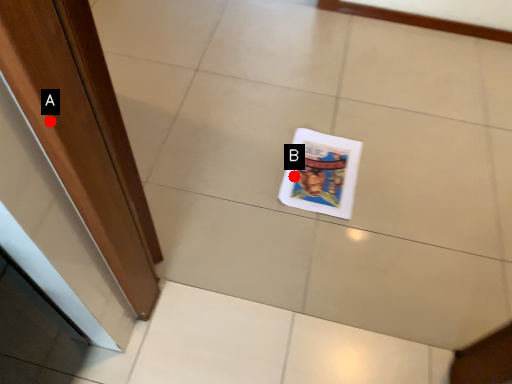
Question: Two points are circled on the image, labeled by A and B beside each circle. Which point appears closest to the camera in this image?

Choices:
 (A) A is closer
 (B) B is closer

Answer: (A)